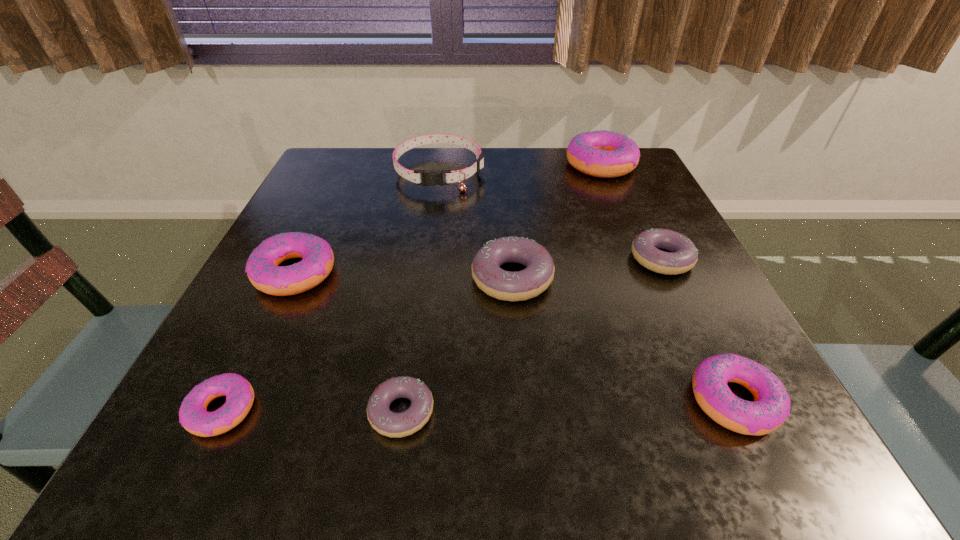
Where is `dog collar at the far edge`? dog collar at the far edge is located at coordinates (429, 178).

The image size is (960, 540). I want to click on object that is at the near left corner, so click(193, 416).

You are a GUI agent. You are given a task and a screenshot of the screen. Output one action in this format:
    pyautogui.click(x=<x>, y=<y>)
    Task: Click on the object that is positioned at the far right corner
    
    Given the screenshot: What is the action you would take?
    pyautogui.click(x=605, y=154)

The image size is (960, 540). Find the location of `object that is positioned at the near right corner`. object that is positioned at the near right corner is located at coordinates (771, 406).

The height and width of the screenshot is (540, 960). In the image, there is a desktop. Find the location of `free space at the far edge`. free space at the far edge is located at coordinates (550, 170).

The image size is (960, 540). I want to click on vacant area at the near edge, so click(x=662, y=440).

You are a GUI agent. You are given a task and a screenshot of the screen. Output one action in this format:
    pyautogui.click(x=<x>, y=<y>)
    Task: Click on the vacant space at the left edge of the desktop
    The height and width of the screenshot is (540, 960).
    Given the screenshot: What is the action you would take?
    pyautogui.click(x=212, y=403)

Where is `free space at the right edge`? The width and height of the screenshot is (960, 540). free space at the right edge is located at coordinates (680, 300).

In the image, there is a desktop. In order to click on vacant space at the far left corner in this screenshot , I will do `click(367, 179)`.

This screenshot has width=960, height=540. What are the coordinates of `free region at the near right corner` in the screenshot? It's located at (798, 464).